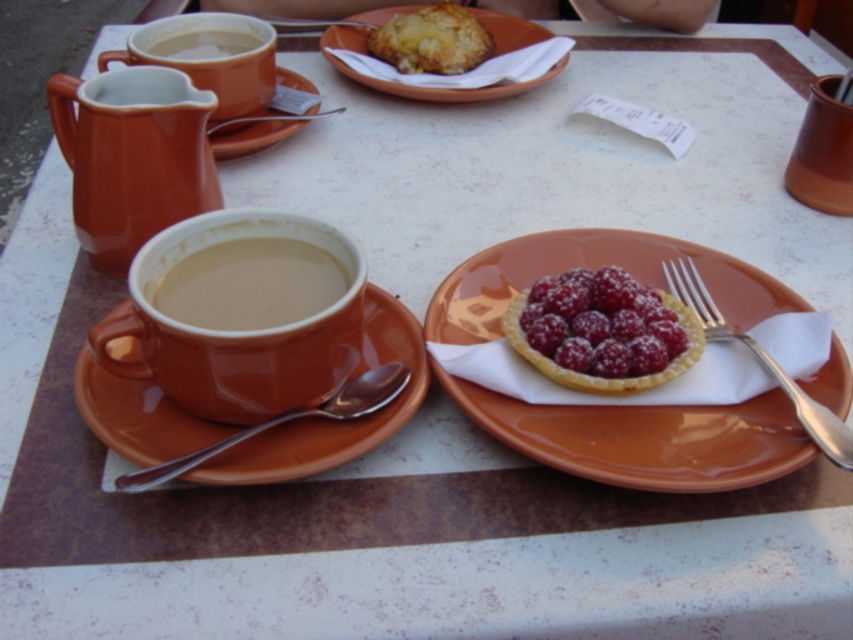
Who is shorter, sugar-coated raspberry tart at center-right or golden flaky pastry at center?

With less height is sugar-coated raspberry tart at center-right.

Is the position of sugar-coated raspberry tart at center-right more distant than that of golden flaky pastry at center?

No, sugar-coated raspberry tart at center-right is closer to the viewer.

Does point (525, 314) come closer to viewer compared to point (437, 13)?

Yes, it is in front of point (437, 13).

This screenshot has width=853, height=640. What are the coordinates of `sugar-coated raspberry tart at center-right` in the screenshot? It's located at (601, 323).

Is matte ceramic plate at center right to the right of matte ceramic pastry at upper center from the viewer's perspective?

Correct, you'll find matte ceramic plate at center right to the right of matte ceramic pastry at upper center.

From the picture: Who is shorter, matte ceramic plate at center right or matte ceramic pastry at upper center?

matte ceramic plate at center right is shorter.

Measure the distance between matte ceramic plate at center right and camera.

matte ceramic plate at center right and camera are 16.99 inches apart from each other.

The height and width of the screenshot is (640, 853). In order to click on matte ceramic plate at center right in this screenshot , I will do `click(646, 438)`.

Between golden flaky pastry at center and silver metallic fork at right, which one has more height?

silver metallic fork at right

Which is behind, point (476, 65) or point (723, 317)?

Point (476, 65)

Where is `golden flaky pastry at center`? golden flaky pastry at center is located at coordinates (431, 40).